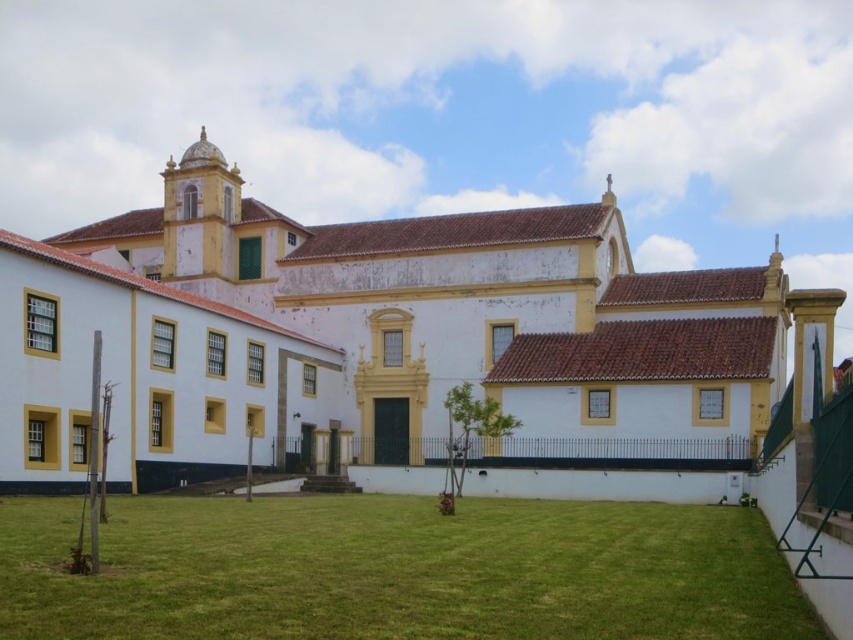
You are a photographer planning to capture the white matte building at center and the green grass at lower center in a single frame. Based on their sizes, which object should you focus on to ensure both are visible without cropping?

The white matte building at center is wider than the green grass at lower center, so focusing on the building will ensure both are visible in the frame.

You are standing on the green grass at lower center and want to enter the white matte building at center. Which direction should you walk to reach the entrance?

The white matte building at center is located above green grass at lower center, so you should walk upward to reach the entrance.